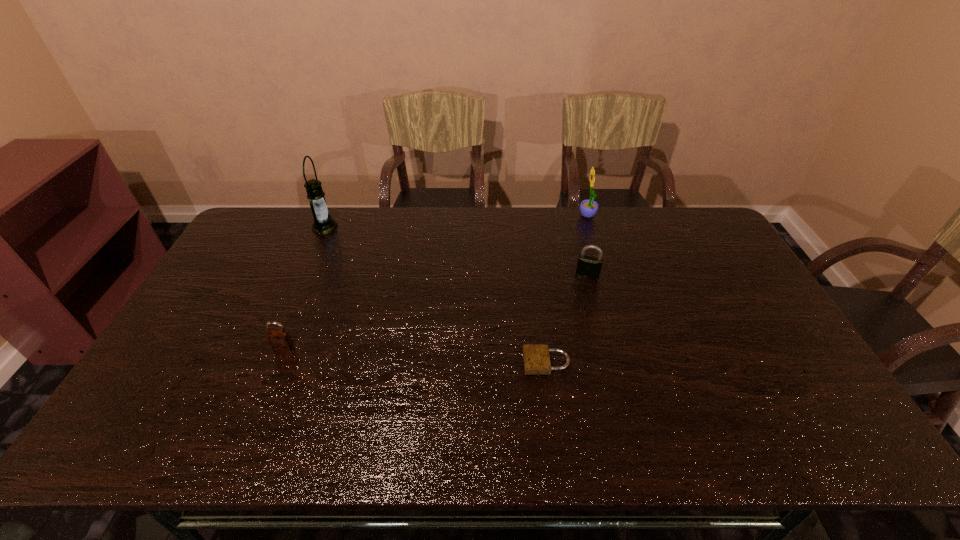
In order to click on vacant area that lies between the tallest object and the farthest padlock in this screenshot , I will do `click(456, 251)`.

What are the coordinates of `empty space between the third farthest object and the lantern` in the screenshot? It's located at (456, 251).

Find the location of a particular element. This screenshot has width=960, height=540. blank region between the lantern and the leftmost padlock is located at coordinates click(304, 287).

You are a GUI agent. You are given a task and a screenshot of the screen. Output one action in this format:
    pyautogui.click(x=<x>, y=<y>)
    Task: Click on the free area in between the farthest padlock and the shortest object
    This screenshot has width=960, height=540.
    Given the screenshot: What is the action you would take?
    pyautogui.click(x=566, y=318)

Identify the location of object that is the fourth closest to the farthest padlock. This screenshot has width=960, height=540. (280, 340).

What are the coordinates of `the fourth closest object to the leftmost padlock` in the screenshot? It's located at (588, 208).

Where is `the second closest padlock to the leftmost padlock`? the second closest padlock to the leftmost padlock is located at coordinates (587, 266).

The height and width of the screenshot is (540, 960). Find the location of `padlock that stands as the second closest to the sunflower`. padlock that stands as the second closest to the sunflower is located at coordinates (536, 357).

You are a GUI agent. You are given a task and a screenshot of the screen. Output one action in this format:
    pyautogui.click(x=<x>, y=<y>)
    Task: Click on the vacant space that satisfies the following two spatial constraints: 1. on the front-facing side of the sunflower; 2. on the front-facing side of the leftmost padlock
    This screenshot has height=540, width=960.
    Given the screenshot: What is the action you would take?
    pyautogui.click(x=628, y=347)